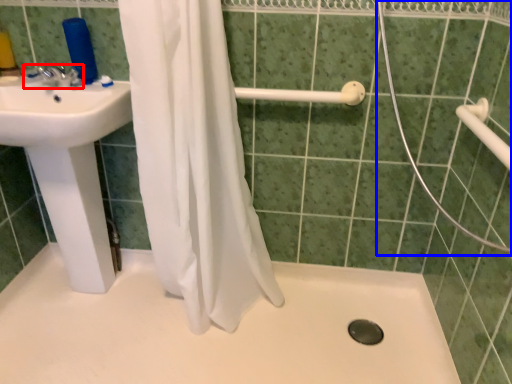
Question: Which of the following is the farthest to the observer, tap (highlighted by a red box) or shower door (highlighted by a blue box)?

Choices:
 (A) tap
 (B) shower door

Answer: (A)